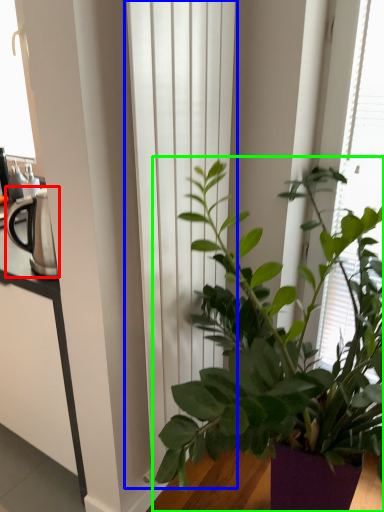
Question: Which object is positioned farthest from appliance (highlighted by a red box)? Select from curtain (highlighted by a blue box) and houseplant (highlighted by a green box).

Choices:
 (A) curtain
 (B) houseplant

Answer: (B)